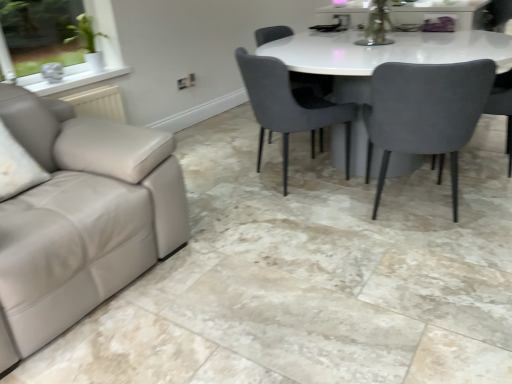
Question: Is velvet grey chair at center, the second chair viewed from the left, taller or shorter than suede gray chair at right, arranged as the third chair when viewed from the left?

Choices:
 (A) tall
 (B) short

Answer: (B)

Question: In the image, is velvet grey chair at center, the second chair viewed from the left, positioned in front of or behind suede gray chair at right, marked as the 2th chair in a right-to-left arrangement?

Choices:
 (A) behind
 (B) front

Answer: (A)

Question: Estimate the real-world distances between objects in this image. Which object is closer to the suede gray chair at right, marked as the 2th chair in a right-to-left arrangement?

Choices:
 (A) velvet grey chair at right, acting as the 4th chair starting from the left
 (B) velvet grey chair at center, positioned as the third chair in right-to-left order
 (C) velvet grey chair at center, which is the 1th chair from left to right

Answer: (C)

Question: Which of these objects is positioned closest to the suede gray chair at right, marked as the 2th chair in a right-to-left arrangement?

Choices:
 (A) velvet grey chair at center, which is the 1th chair from left to right
 (B) velvet grey chair at center, the second chair viewed from the left
 (C) velvet grey chair at right, acting as the 4th chair starting from the left

Answer: (A)